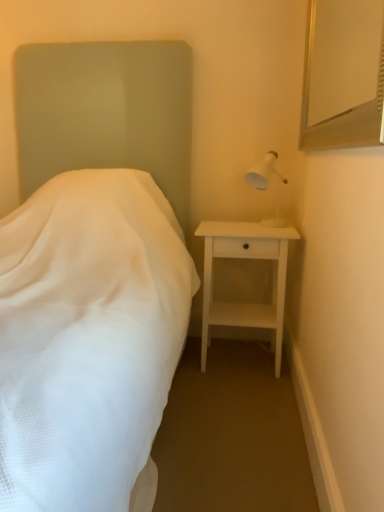
Question: Is white matte nightstand at right completely or partially outside of white fabric bed at left?

Choices:
 (A) yes
 (B) no

Answer: (A)

Question: Does white matte nightstand at right have a greater width compared to white fabric bed at left?

Choices:
 (A) no
 (B) yes

Answer: (A)

Question: Is white fabric bed at left surrounded by white matte nightstand at right?

Choices:
 (A) no
 (B) yes

Answer: (A)

Question: Is white matte nightstand at right oriented towards white fabric bed at left?

Choices:
 (A) no
 (B) yes

Answer: (A)

Question: From a real-world perspective, is white matte nightstand at right over white fabric bed at left?

Choices:
 (A) yes
 (B) no

Answer: (B)

Question: Would you consider white matte nightstand at right to be distant from white fabric bed at left?

Choices:
 (A) no
 (B) yes

Answer: (A)

Question: Can you confirm if white plastic lamp at upper right is thinner than white matte nightstand at right?

Choices:
 (A) no
 (B) yes

Answer: (B)

Question: Is white plastic lamp at upper right positioned behind white matte nightstand at right?

Choices:
 (A) yes
 (B) no

Answer: (B)

Question: Is white matte nightstand at right a part of white plastic lamp at upper right?

Choices:
 (A) yes
 (B) no

Answer: (B)

Question: Does white plastic lamp at upper right turn towards white matte nightstand at right?

Choices:
 (A) no
 (B) yes

Answer: (A)

Question: Can you confirm if white plastic lamp at upper right is positioned to the left of white matte nightstand at right?

Choices:
 (A) yes
 (B) no

Answer: (B)

Question: From a real-world perspective, does white plastic lamp at upper right sit lower than white matte nightstand at right?

Choices:
 (A) no
 (B) yes

Answer: (A)

Question: Does white plastic lamp at upper right have a greater height compared to white fabric bed at left?

Choices:
 (A) no
 (B) yes

Answer: (A)